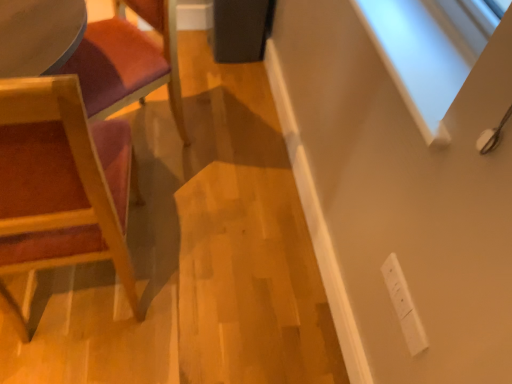
This screenshot has height=384, width=512. What are the coordinates of `vacant space underneath wooden chair at left, the 2th chair ordered from the bottom (from a real-world perspective)` in the screenshot? It's located at (146, 130).